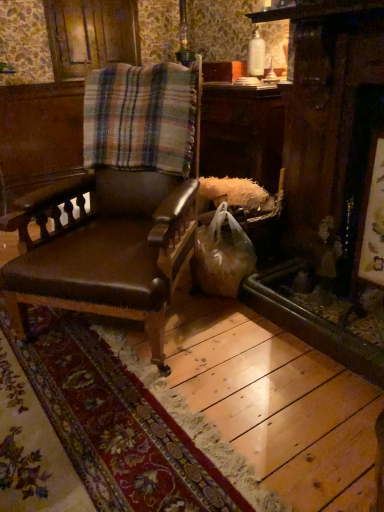
Question: Should I look upward or downward to see matte brown leather chair at center?

Choices:
 (A) down
 (B) up

Answer: (B)

Question: Is plaid fabric at center facing away from matte brown leather chair at center?

Choices:
 (A) yes
 (B) no

Answer: (A)

Question: From a real-world perspective, is plaid fabric at center beneath matte brown leather chair at center?

Choices:
 (A) yes
 (B) no

Answer: (B)

Question: Can you see plaid fabric at center touching matte brown leather chair at center?

Choices:
 (A) yes
 (B) no

Answer: (B)

Question: Is plaid fabric at center facing towards matte brown leather chair at center?

Choices:
 (A) yes
 (B) no

Answer: (A)

Question: Can you confirm if plaid fabric at center is thinner than matte brown leather chair at center?

Choices:
 (A) no
 (B) yes

Answer: (B)

Question: Does plaid fabric at center lie in front of matte brown leather chair at center?

Choices:
 (A) no
 (B) yes

Answer: (A)

Question: Is matte brown leather chair at center wider than translucent plastic bag at lower right?

Choices:
 (A) no
 (B) yes

Answer: (B)

Question: Does matte brown leather chair at center turn towards translucent plastic bag at lower right?

Choices:
 (A) yes
 (B) no

Answer: (B)

Question: Is matte brown leather chair at center positioned before translucent plastic bag at lower right?

Choices:
 (A) no
 (B) yes

Answer: (B)

Question: Is matte brown leather chair at center taller than translucent plastic bag at lower right?

Choices:
 (A) yes
 (B) no

Answer: (A)

Question: Would you say translucent plastic bag at lower right is part of matte brown leather chair at center's contents?

Choices:
 (A) no
 (B) yes

Answer: (A)

Question: From a real-world perspective, does matte brown leather chair at center stand above translucent plastic bag at lower right?

Choices:
 (A) yes
 (B) no

Answer: (A)

Question: Are plaid fabric at center and translucent plastic bag at lower right making contact?

Choices:
 (A) no
 (B) yes

Answer: (A)